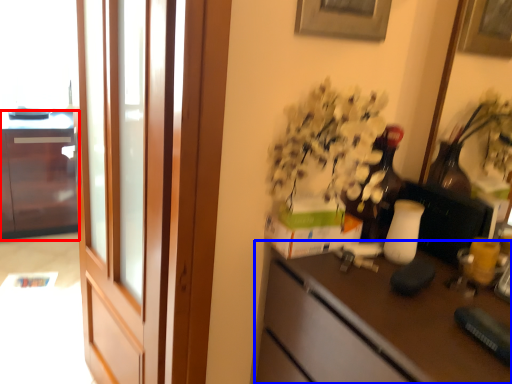
Question: Which object appears farthest to the camera in this image, cabinetry (highlighted by a red box) or desk (highlighted by a blue box)?

Choices:
 (A) cabinetry
 (B) desk

Answer: (A)